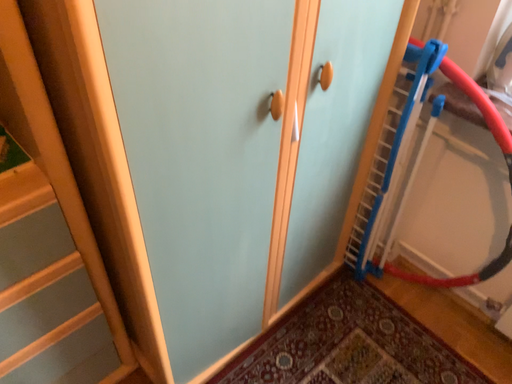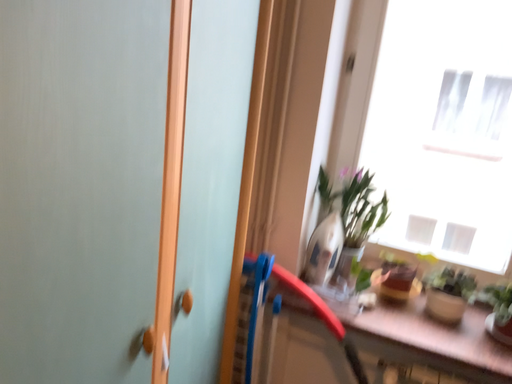
Question: Which way did the camera rotate in the video?

Choices:
 (A) rotated left
 (B) rotated right

Answer: (B)